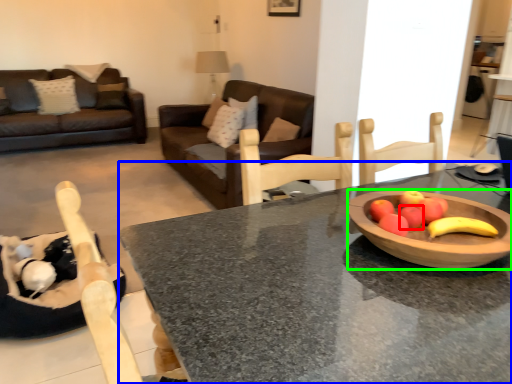
Question: Which object is positioned closest to apple (highlighted by a red box)? Select from desk (highlighted by a blue box) and bowl (highlighted by a green box).

Choices:
 (A) desk
 (B) bowl

Answer: (B)